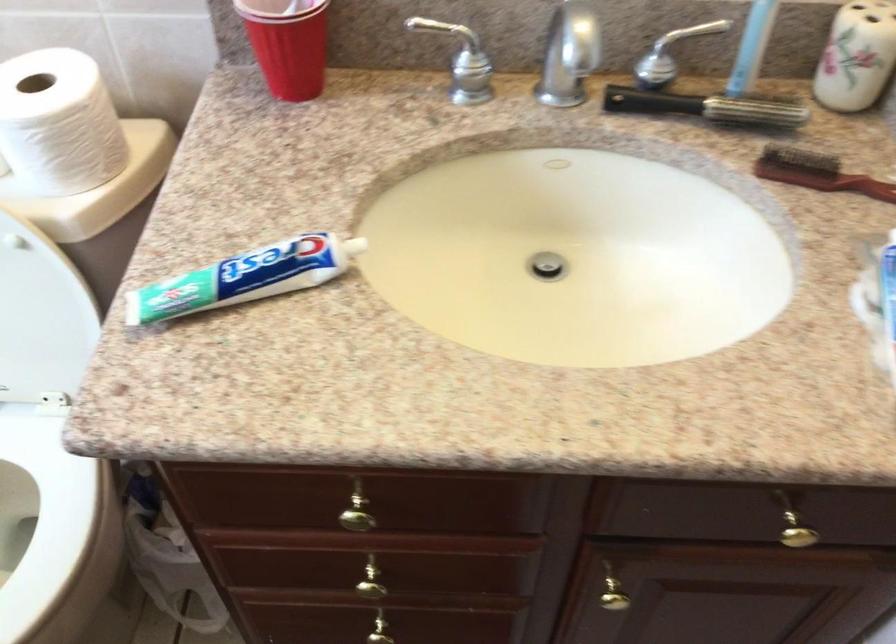
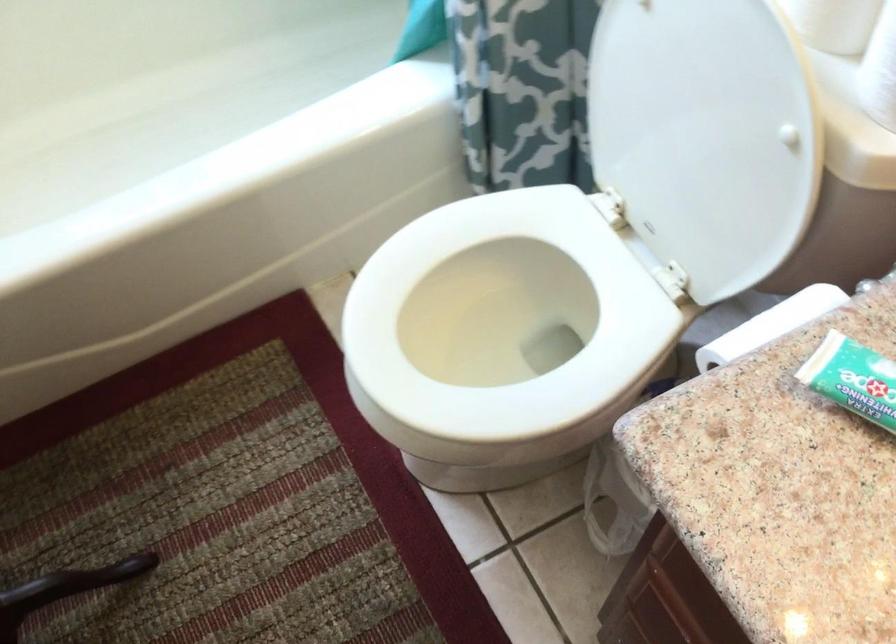
Based on the photo, based on the continuous images, in which direction is the camera rotating?

The camera's rotation is toward left-down.